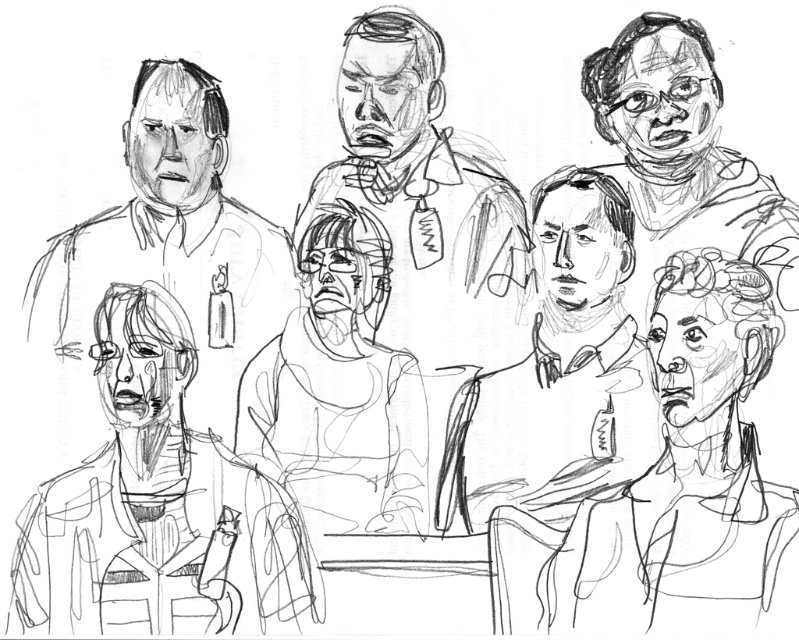
Question: Does smooth paper man at center have a greater width compared to matte black shirt at upper left?

Choices:
 (A) yes
 (B) no

Answer: (B)

Question: Which of the following is the farthest from the observer?

Choices:
 (A) matte black shirt at upper left
 (B) smooth skin face at upper right

Answer: (A)

Question: Which point is closer to the camera taking this photo?

Choices:
 (A) (674, 161)
 (B) (197, 132)

Answer: (A)

Question: Is smooth paper man at center to the right of smooth skin face at upper right from the viewer's perspective?

Choices:
 (A) no
 (B) yes

Answer: (A)

Question: Among these points, which one is nearest to the camera?

Choices:
 (A) (185, 401)
 (B) (599, 129)

Answer: (A)

Question: In this image, where is smooth paper man at center located relative to smooth skin face at upper right?

Choices:
 (A) above
 (B) below

Answer: (B)